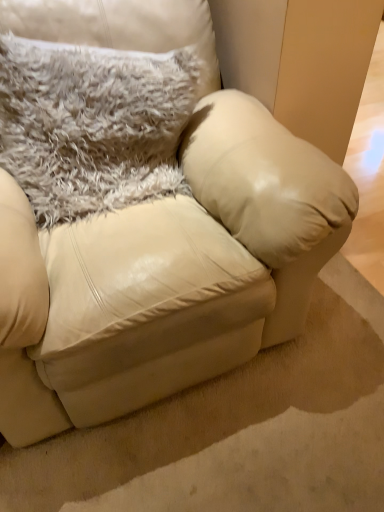
Where is `fuzzy beige pillow at upper left`? Image resolution: width=384 pixels, height=512 pixels. fuzzy beige pillow at upper left is located at coordinates (93, 125).

What is the approximate width of fuzzy beige pillow at upper left?

10.96 inches.

What do you see at coordinates (93, 125) in the screenshot? I see `fuzzy beige pillow at upper left` at bounding box center [93, 125].

Locate an element on the screen. This screenshot has height=512, width=384. fuzzy beige pillow at upper left is located at coordinates (93, 125).